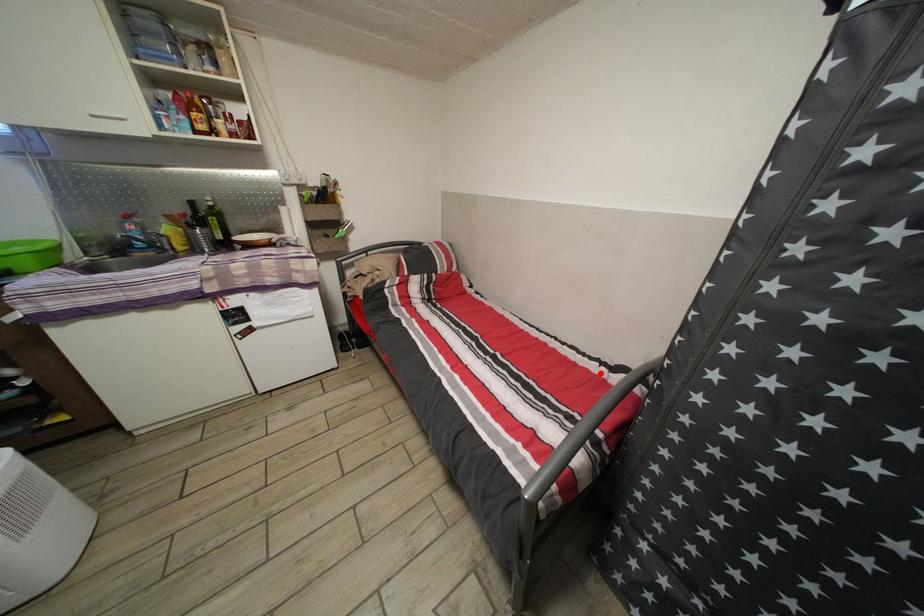
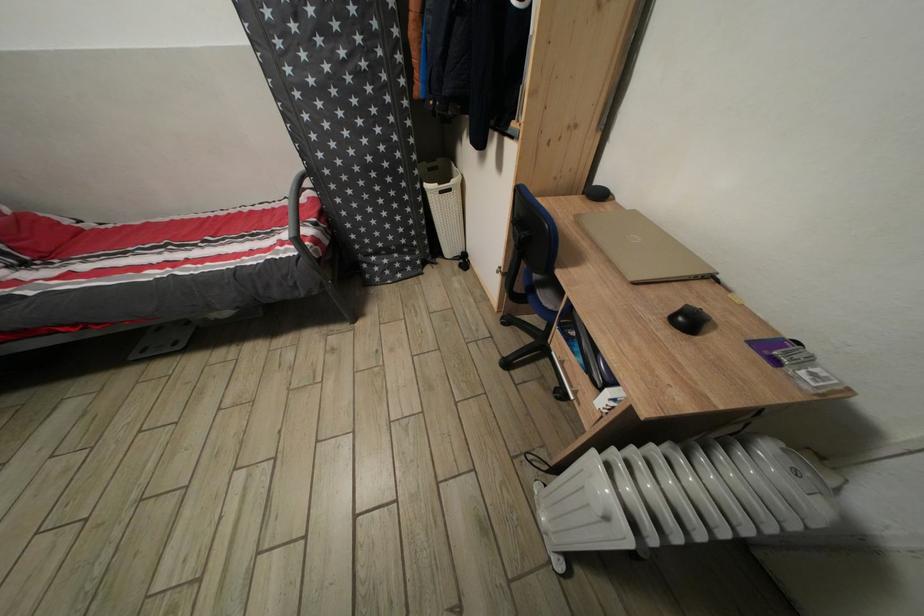
The point at the highlighted location is marked in the first image. Where is the corresponding point in the second image?

(294, 209)